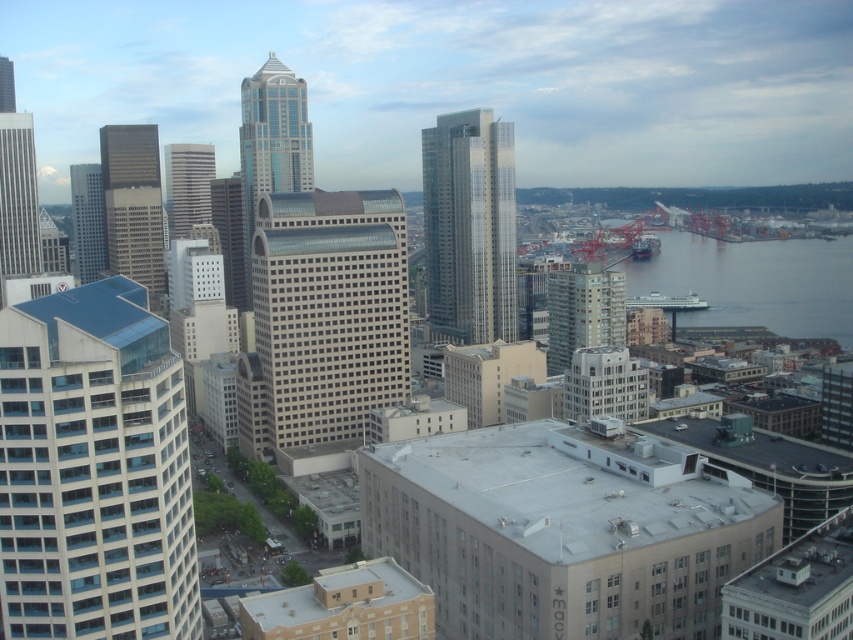
You are standing at a viewpoint overlooking the city and want to know how far the point at coordinates (x=107, y=268) is from your current position. Can you determine the distance?

The distance between the point at coordinates (x=107, y=268) and your current position is 1997.55 feet.

Looking at this image, looking at the cityscape from this high vantage point, which of the two skyscrapers, the glassy reflective skyscraper at left or the matte glass skyscraper at upper left, is positioned farther to the east?

The glassy reflective skyscraper at left is positioned to the left of the matte glass skyscraper at upper left. Since the cityscape is viewed from a high vantage point, the glassy reflective skyscraper at left is farther to the east because it is positioned to the left in the image, which typically corresponds to east in such views.

You are a drone operator trying to deliver a package to a specific point on a glassy silver skyscraper at center. The coordinates given are point (469,227). Based on the scene description, can you confirm if this point is indeed on the glassy silver skyscraper at center?

Yes, according to the description, point (469,227) is on the glassy silver skyscraper at center, so the coordinates are correct.